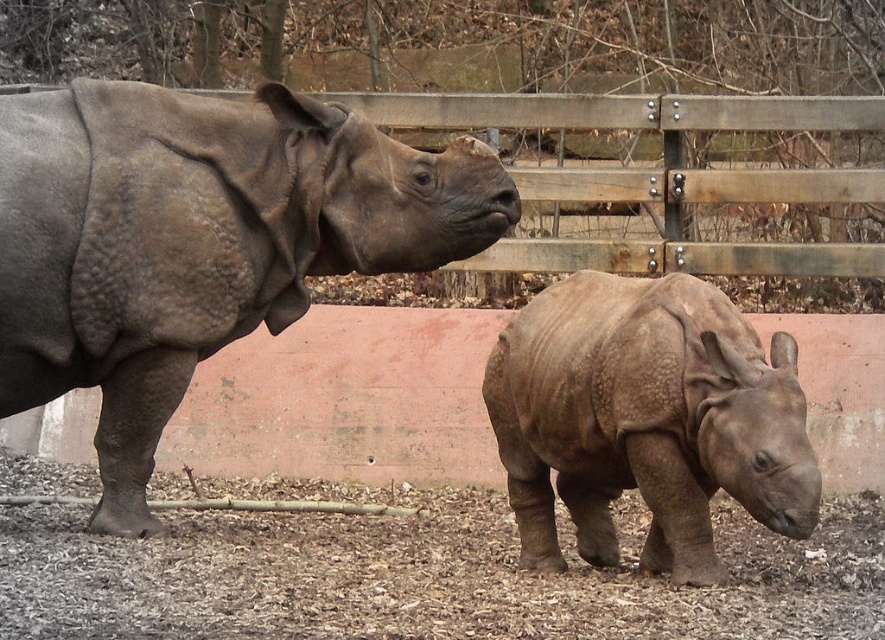
You are a zookeeper who needs to move a 1.2 meter wide feeding cart between the gray textured rhino at left and the matte gray rhino at center. Can the cart fit through the space between them?

The distance between the gray textured rhino at left and the matte gray rhino at center is 1.15 meters. Since the feeding cart is 1.2 meters wide, it cannot fit through the space between them as the gap is narrower than the cart.

You are a zookeeper who needs to feed the gray textured rhino at left and the matte gray rhino at center. If you have a limited amount of food, which rhino should you give more food to based on their sizes?

The gray textured rhino at left is bigger than the matte gray rhino at center, so you should give more food to the gray textured rhino at left.